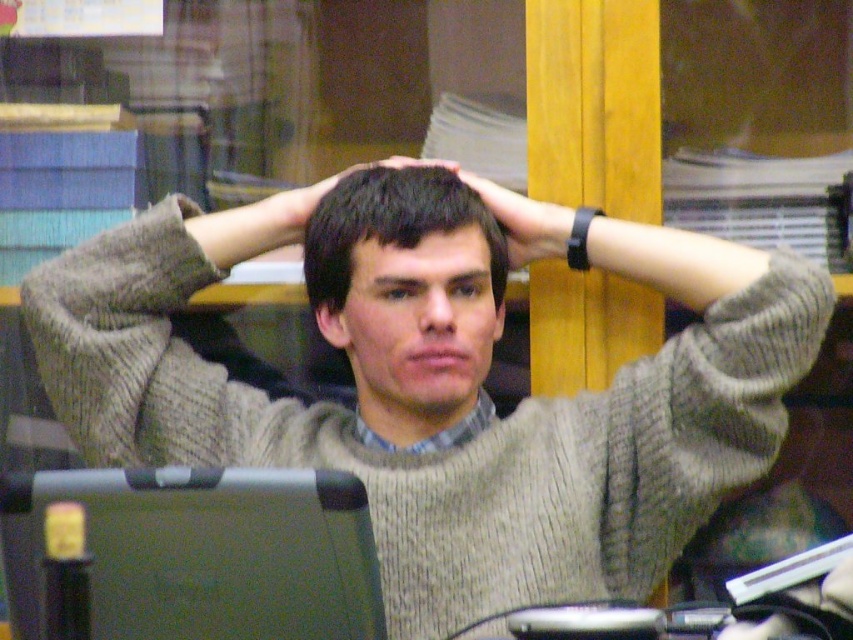
Question: Does gray knitted sweater at center have a smaller size compared to matte green laptop at lower left?

Choices:
 (A) yes
 (B) no

Answer: (B)

Question: Estimate the real-world distances between objects in this image. Which object is farther from the dark brown hair at center?

Choices:
 (A) matte green laptop at lower left
 (B) gray knitted sweater at center

Answer: (A)

Question: Among these objects, which one is farthest from the camera?

Choices:
 (A) matte green laptop at lower left
 (B) black matte wristband at center

Answer: (B)

Question: Can you confirm if gray knitted sweater at center is bigger than black matte wristband at center?

Choices:
 (A) no
 (B) yes

Answer: (B)

Question: Is gray knitted sweater at center above black matte wristband at center?

Choices:
 (A) yes
 (B) no

Answer: (B)

Question: Which object is positioned closest to the matte green laptop at lower left?

Choices:
 (A) dark brown hair at center
 (B) gray knitted sweater at center

Answer: (A)